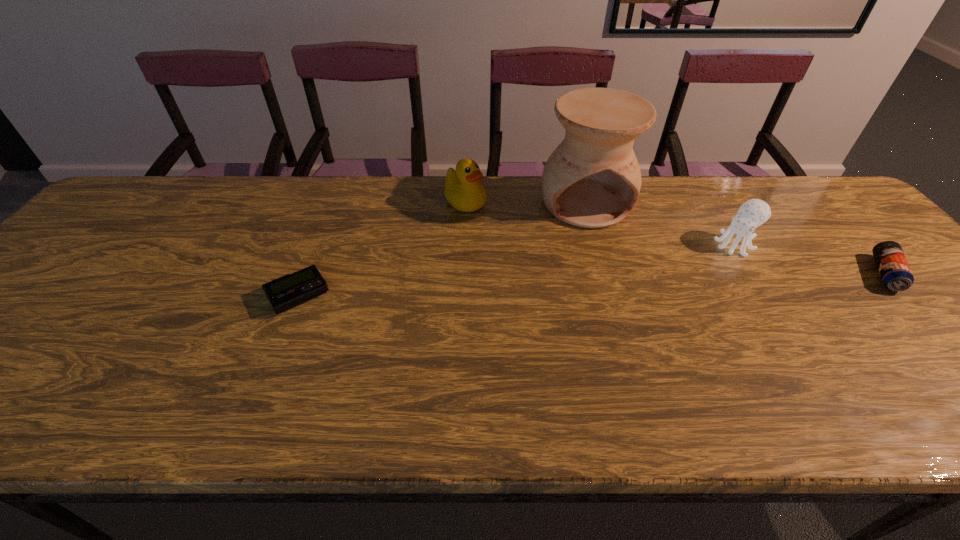
This screenshot has height=540, width=960. In order to click on vacant space on the desktop that is between the leftmost object and the second shortest object and is positioned on the front-facing side of the fourth object from left to right in this screenshot , I will do `click(685, 281)`.

Identify the location of free space on the desktop that is between the shortest object and the rightmost object and is positioned at the beak of the duck. (579, 285).

Image resolution: width=960 pixels, height=540 pixels. Identify the location of vacant space on the desktop that is between the beeper and the fourth tallest object and is positioned at the open side of the tallest object. (620, 284).